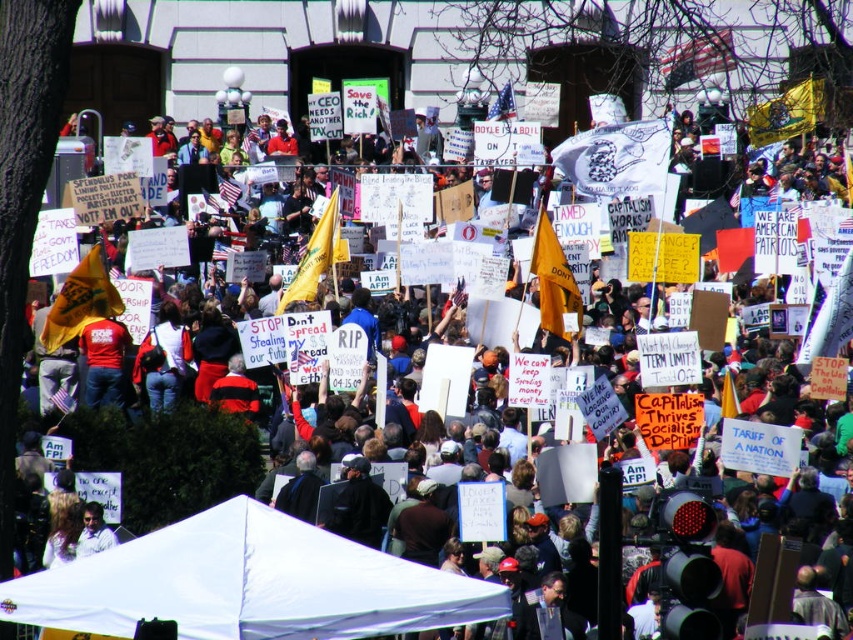
Question: From the image, what is the correct spatial relationship of white fabric tent at center in relation to light brown hair at lower left?

Choices:
 (A) left
 (B) right

Answer: (B)

Question: Which point is farther to the camera?

Choices:
 (A) white fabric tent at center
 (B) light brown hair at lower left

Answer: (B)

Question: Can you confirm if white fabric tent at center is positioned below light brown hair at lower left?

Choices:
 (A) yes
 (B) no

Answer: (A)

Question: Which object is closer to the camera taking this photo?

Choices:
 (A) white fabric tent at center
 (B) light brown hair at lower left

Answer: (A)

Question: Which point is closer to the camera?

Choices:
 (A) light brown hair at lower left
 (B) white fabric tent at center

Answer: (B)

Question: Does white fabric tent at center have a greater width compared to light brown hair at lower left?

Choices:
 (A) no
 (B) yes

Answer: (B)